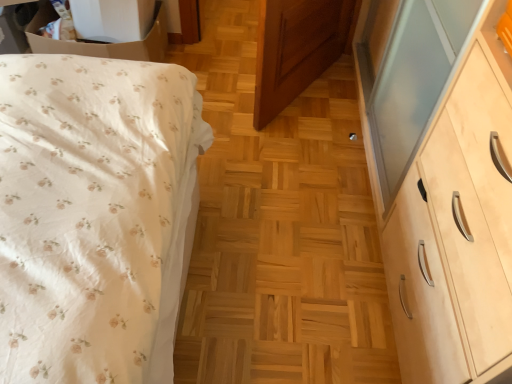
This screenshot has width=512, height=384. What do you see at coordinates (101, 44) in the screenshot?
I see `white cardboard box at upper left` at bounding box center [101, 44].

Locate an element on the screen. This screenshot has width=512, height=384. white cardboard box at upper left is located at coordinates (101, 44).

This screenshot has height=384, width=512. I want to click on white cardboard box at upper left, so click(x=101, y=44).